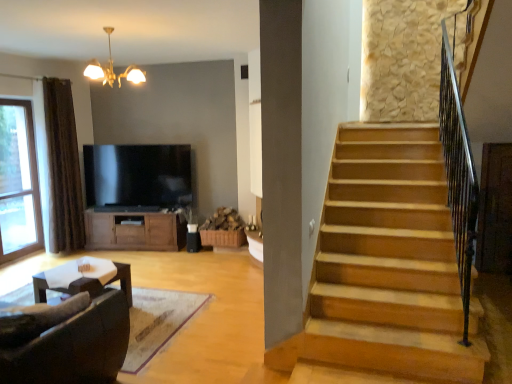
Question: Would you say brown wood cabinet at center is to the left or to the right of brown fabric curtain at left in the picture?

Choices:
 (A) right
 (B) left

Answer: (A)

Question: Is brown wood cabinet at center spatially inside brown fabric curtain at left, or outside of it?

Choices:
 (A) outside
 (B) inside

Answer: (A)

Question: Which object is the farthest from the transparent glass window at left?

Choices:
 (A) dark brown leather couch at lower left
 (B) brown fabric curtain at left
 (C) gold metallic chandelier at upper center
 (D) flat screen tv at center
 (E) brown wood cabinet at center

Answer: (A)

Question: Which object is the farthest from the brown fabric curtain at left?

Choices:
 (A) transparent glass window at left
 (B) gold metallic chandelier at upper center
 (C) dark brown leather couch at lower left
 (D) brown wood cabinet at center
 (E) flat screen tv at center

Answer: (C)